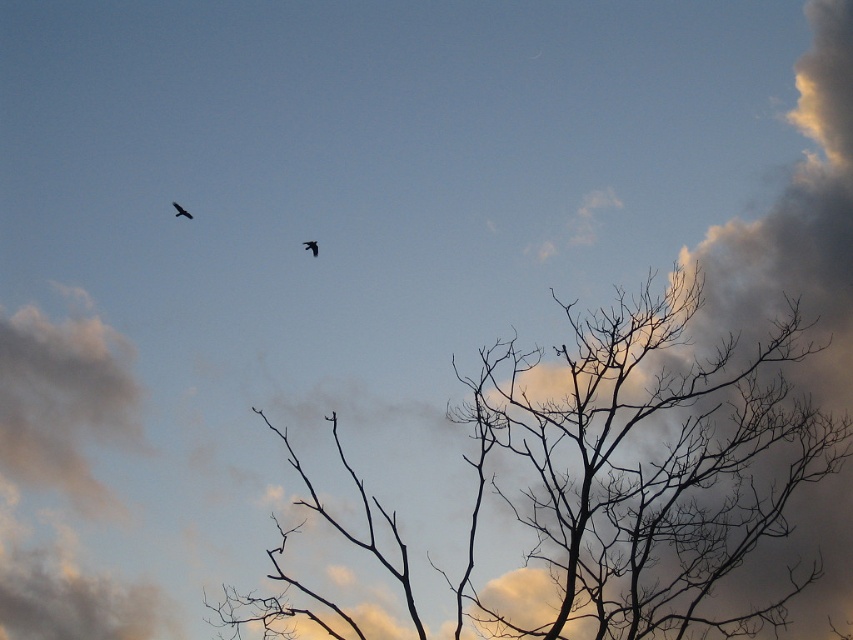
You are an ornithologist observing two birds in the sky. You have a camera with a lens that can capture objects up to 5 feet apart clearly in the same frame. The birds are the black matte bird at upper left and the silhouette feathered bird at upper left. Can your camera capture both birds clearly in one frame?

The black matte bird at upper left and silhouette feathered bird at upper left are 5.13 feet apart from each other. Since the camera can capture up to 5 feet, the distance between them exceeds the camera lens capacity, so they cannot be captured clearly in the same frame.

You are an astronomer analyzing the image of the sky. You notice two points in the scene at coordinates point (x=802, y=477) and point (x=310, y=248). Which point is closer to your position as the observer?

Point (x=802, y=477) is further to the viewer than point (x=310, y=248), so the closer point to you as the observer is point (x=310, y=248).